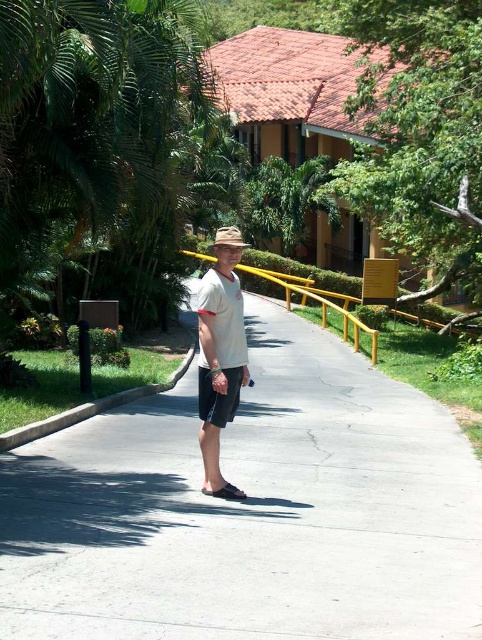
Question: Which is nearer to the white concrete pavement at center?

Choices:
 (A) black rubber sandal at lower center
 (B) white matte shirt at center
 (C) black cotton shorts at center
 (D) brown straw hat at center

Answer: (A)

Question: Which object appears closest to the camera in this image?

Choices:
 (A) brown straw hat at center
 (B) black cotton shorts at center

Answer: (A)

Question: From the image, what is the correct spatial relationship of white concrete pavement at center in relation to black cotton shorts at center?

Choices:
 (A) right
 (B) left

Answer: (A)

Question: Estimate the real-world distances between objects in this image. Which object is closer to the white concrete pavement at center?

Choices:
 (A) yellow metal rail at center
 (B) black cotton shorts at center
 (C) brown straw hat at center

Answer: (B)

Question: Does white matte shirt at center appear under brown straw hat at center?

Choices:
 (A) no
 (B) yes

Answer: (B)

Question: In this image, where is white matte shirt at center located relative to brown straw hat at center?

Choices:
 (A) below
 (B) above

Answer: (A)